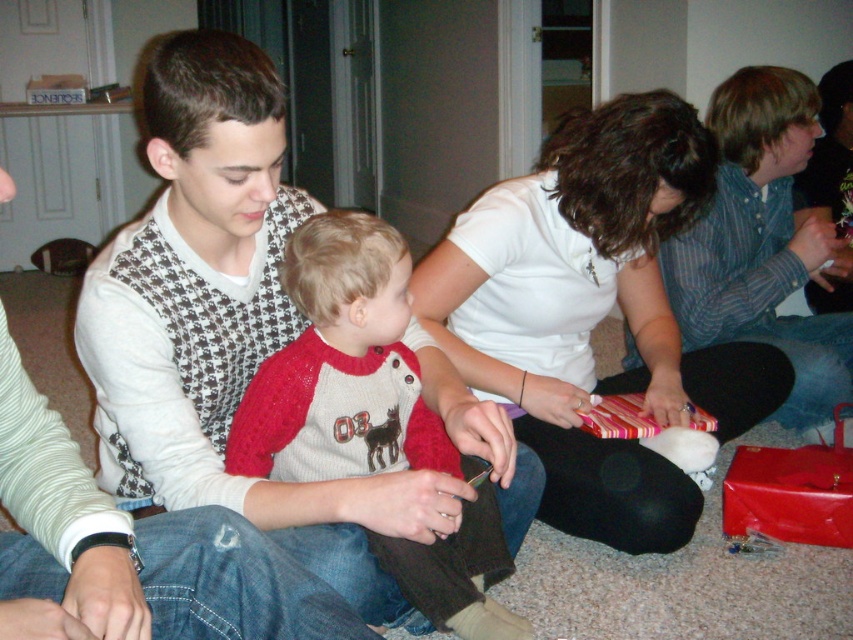
From the picture: Does red knit sweater at center have a lesser width compared to white sweater vest at center?

Incorrect, red knit sweater at center's width is not less than white sweater vest at center's.

Does red knit sweater at center appear on the left side of white sweater vest at center?

In fact, red knit sweater at center is to the right of white sweater vest at center.

Between point (457, 547) and point (0, 560), which one is positioned behind?

Positioned behind is point (457, 547).

I want to click on red knit sweater at center, so click(x=341, y=365).

Does white matte shirt at center have a lesser width compared to white sweater vest at center?

In fact, white matte shirt at center might be wider than white sweater vest at center.

Image resolution: width=853 pixels, height=640 pixels. In order to click on white matte shirt at center in this screenshot , I will do `click(595, 314)`.

Is white matte shirt at center shorter than red knit sweater at center?

No.

Between white matte shirt at center and red knit sweater at center, which one is positioned lower?

Positioned lower is red knit sweater at center.

The width and height of the screenshot is (853, 640). What do you see at coordinates (595, 314) in the screenshot?
I see `white matte shirt at center` at bounding box center [595, 314].

Locate an element on the screen. The height and width of the screenshot is (640, 853). white matte shirt at center is located at coordinates (595, 314).